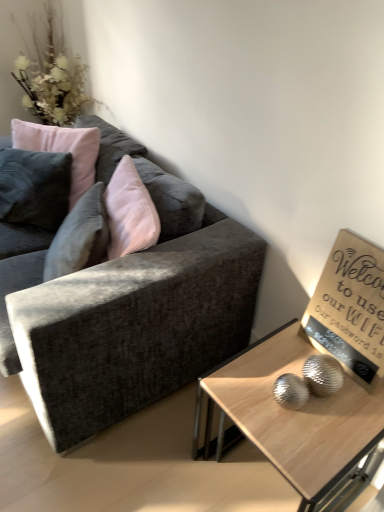
Question: Should I look upward or downward to see wooden sign at upper right?

Choices:
 (A) up
 (B) down

Answer: (B)

Question: Can you confirm if white fluffy flowers at upper left is positioned to the right of wooden sign at upper right?

Choices:
 (A) yes
 (B) no

Answer: (B)

Question: Is white fluffy flowers at upper left wider than wooden sign at upper right?

Choices:
 (A) no
 (B) yes

Answer: (B)

Question: Could you tell me if white fluffy flowers at upper left is facing wooden sign at upper right?

Choices:
 (A) no
 (B) yes

Answer: (A)

Question: Does white fluffy flowers at upper left appear on the left side of wooden sign at upper right?

Choices:
 (A) yes
 (B) no

Answer: (A)

Question: Is white fluffy flowers at upper left thinner than wooden sign at upper right?

Choices:
 (A) yes
 (B) no

Answer: (B)

Question: Does white fluffy flowers at upper left have a greater height compared to wooden sign at upper right?

Choices:
 (A) no
 (B) yes

Answer: (B)

Question: Does white fluffy flowers at upper left have a greater height compared to wooden glossy coffee table at lower right?

Choices:
 (A) yes
 (B) no

Answer: (A)

Question: From the image's perspective, is white fluffy flowers at upper left under wooden glossy coffee table at lower right?

Choices:
 (A) yes
 (B) no

Answer: (B)

Question: Is white fluffy flowers at upper left bigger than wooden glossy coffee table at lower right?

Choices:
 (A) no
 (B) yes

Answer: (B)

Question: Can you confirm if white fluffy flowers at upper left is shorter than wooden glossy coffee table at lower right?

Choices:
 (A) no
 (B) yes

Answer: (A)

Question: Is white fluffy flowers at upper left at the left side of wooden glossy coffee table at lower right?

Choices:
 (A) yes
 (B) no

Answer: (A)

Question: Are white fluffy flowers at upper left and wooden glossy coffee table at lower right located far from each other?

Choices:
 (A) yes
 (B) no

Answer: (A)

Question: Can you confirm if velvet pink pillow at upper left is thinner than white fluffy flowers at upper left?

Choices:
 (A) yes
 (B) no

Answer: (A)